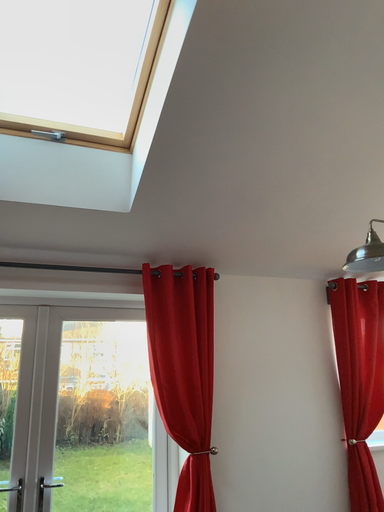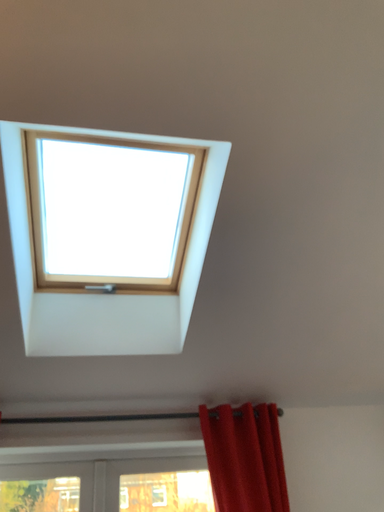
Question: Which way did the camera rotate in the video?

Choices:
 (A) rotated upward
 (B) rotated downward

Answer: (A)